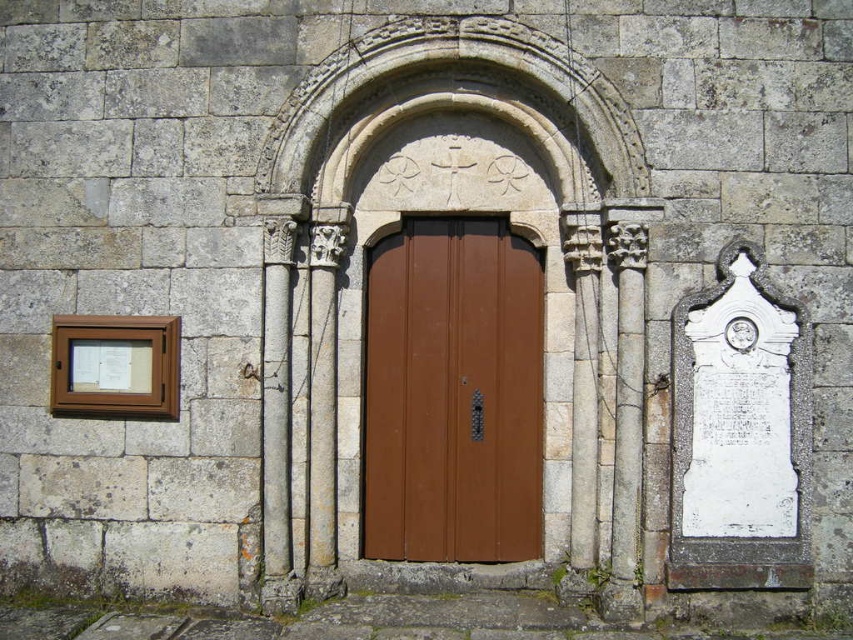
Measure the distance between brown matte door at center and camera.

brown matte door at center and camera are 7.14 meters apart from each other.

What do you see at coordinates (451, 394) in the screenshot? Image resolution: width=853 pixels, height=640 pixels. I see `brown matte door at center` at bounding box center [451, 394].

Image resolution: width=853 pixels, height=640 pixels. Find the location of `brown matte door at center`. brown matte door at center is located at coordinates (451, 394).